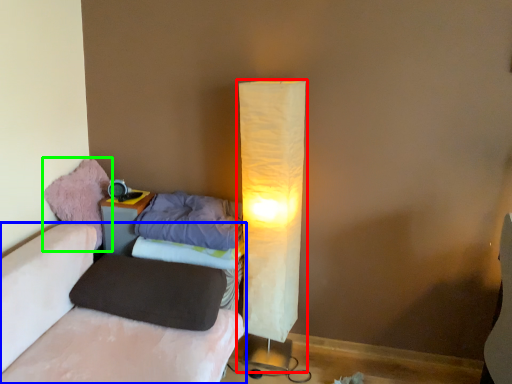
Question: Considering the real-world distances, which object is closest to lamp (highlighted by a red box)? furniture (highlighted by a blue box) or bean bag chair (highlighted by a green box).

Choices:
 (A) furniture
 (B) bean bag chair

Answer: (A)